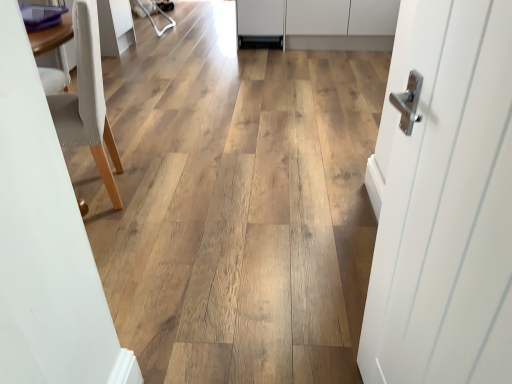
At what (x,y) coordinates should I click in order to perform the action: click on vacant space in front of white matte cabinet at upper center. Please return your answer as a coordinate pair (x, y). Looking at the image, I should click on (284, 72).